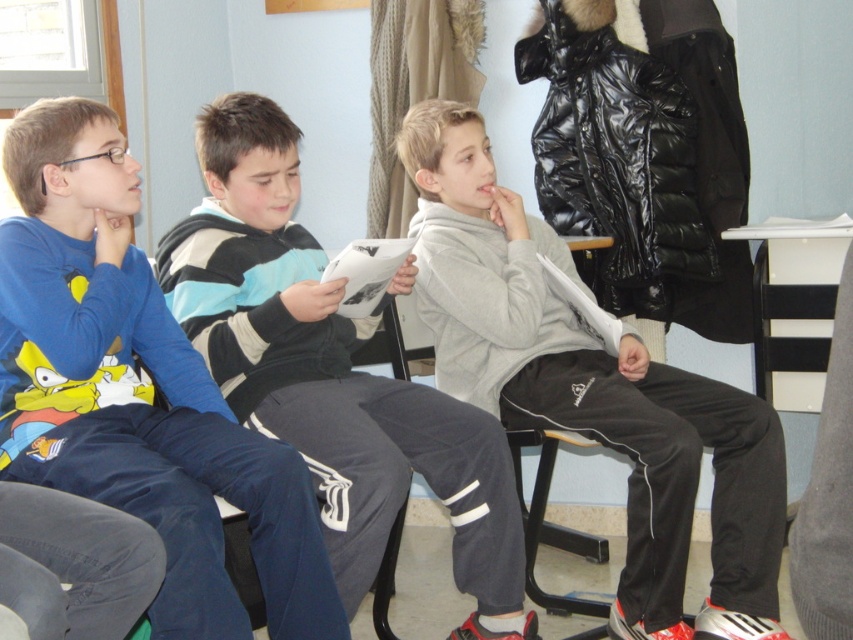
Question: Does blue cotton shirt at left appear on the right side of striped sweater at center?

Choices:
 (A) yes
 (B) no

Answer: (B)

Question: Can you confirm if blue cotton shirt at left is bigger than gray matte sweatshirt at center?

Choices:
 (A) yes
 (B) no

Answer: (B)

Question: Which object is farther from the camera taking this photo?

Choices:
 (A) gray matte sweatshirt at center
 (B) blue cotton shirt at left
 (C) striped sweater at center

Answer: (A)

Question: In this image, where is gray matte sweatshirt at center located relative to striped sweater at center?

Choices:
 (A) below
 (B) above

Answer: (B)

Question: Which of the following is the farthest from the observer?

Choices:
 (A) gray matte sweatshirt at center
 (B) blue cotton shirt at left
 (C) striped sweater at center

Answer: (A)

Question: Estimate the real-world distances between objects in this image. Which object is closer to the blue cotton shirt at left?

Choices:
 (A) striped sweater at center
 (B) gray matte sweatshirt at center

Answer: (A)